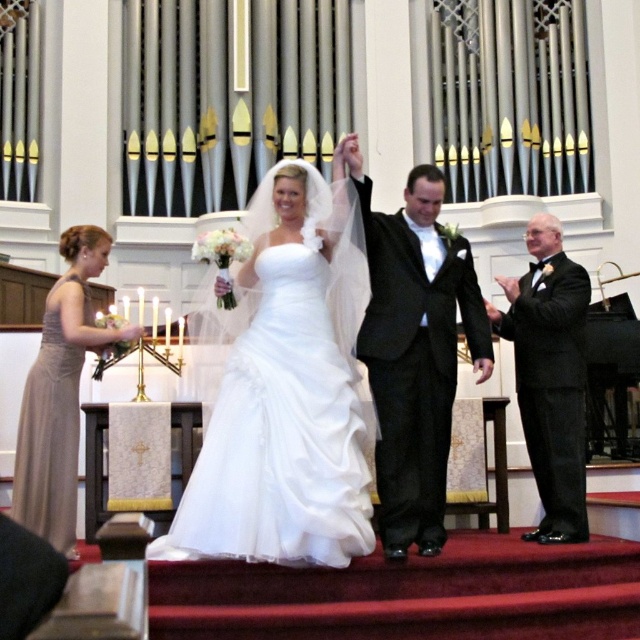
Question: Is white satin dress at center wider than satin beige dress at lower left?

Choices:
 (A) no
 (B) yes

Answer: (B)

Question: Is black satin tuxedo at center further to camera compared to satin beige dress at lower left?

Choices:
 (A) yes
 (B) no

Answer: (B)

Question: Based on their relative distances, which object is farther from the satin beige dress at lower left?

Choices:
 (A) black satin suit at right
 (B) satin/sheer wedding dress at left
 (C) white satin dress at center
 (D) black satin tuxedo at center

Answer: (A)

Question: Which object appears closest to the camera in this image?

Choices:
 (A) black satin tuxedo at center
 (B) black satin suit at right
 (C) white satin dress at center
 (D) satin/sheer wedding dress at left

Answer: (C)

Question: Based on their relative distances, which object is farther from the black satin tuxedo at center?

Choices:
 (A) satin/sheer wedding dress at left
 (B) black satin suit at right
 (C) white satin dress at center

Answer: (A)

Question: Observing the image, what is the correct spatial positioning of black satin tuxedo at center in reference to black satin suit at right?

Choices:
 (A) above
 (B) below

Answer: (A)